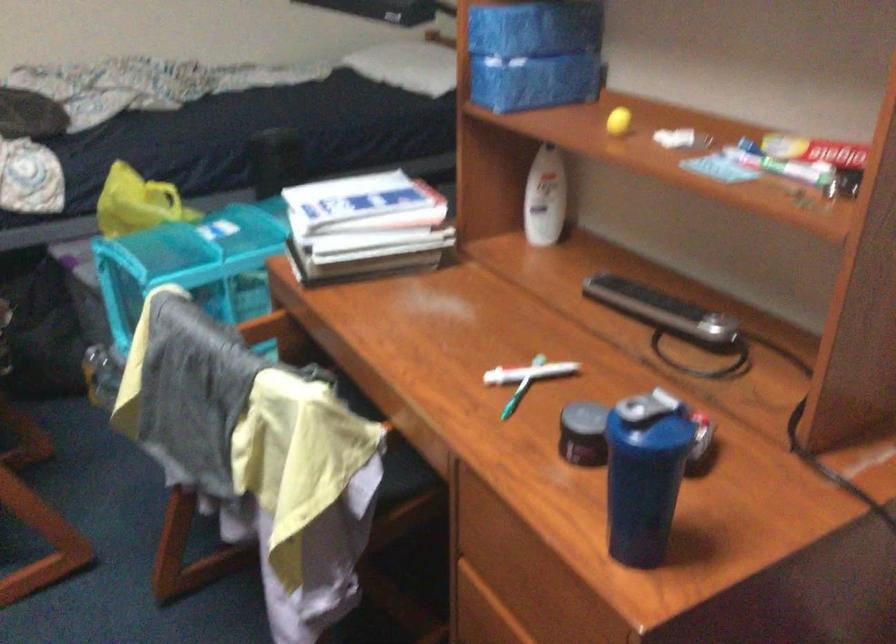
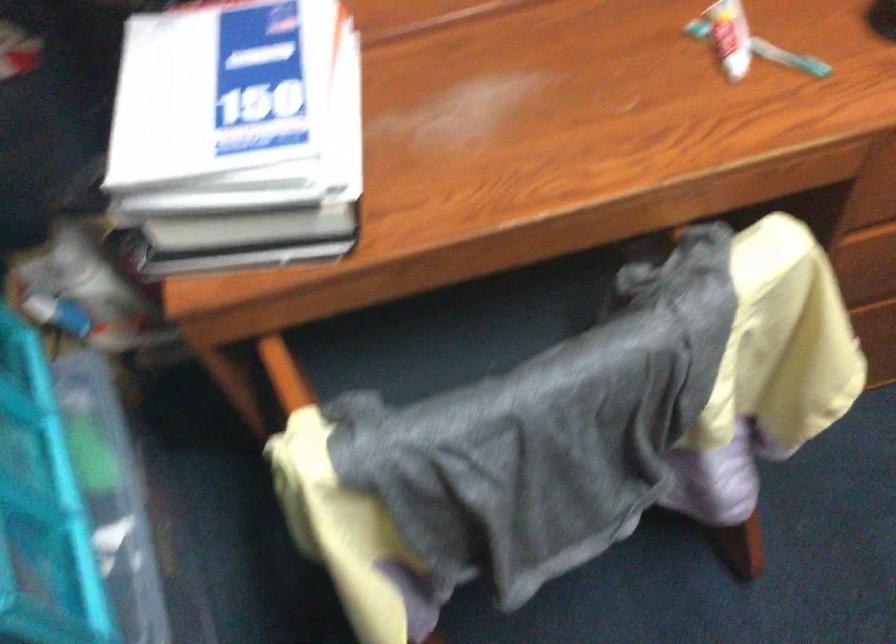
In the second image, find the point that corresponds to (519,404) in the first image.

(789, 58)